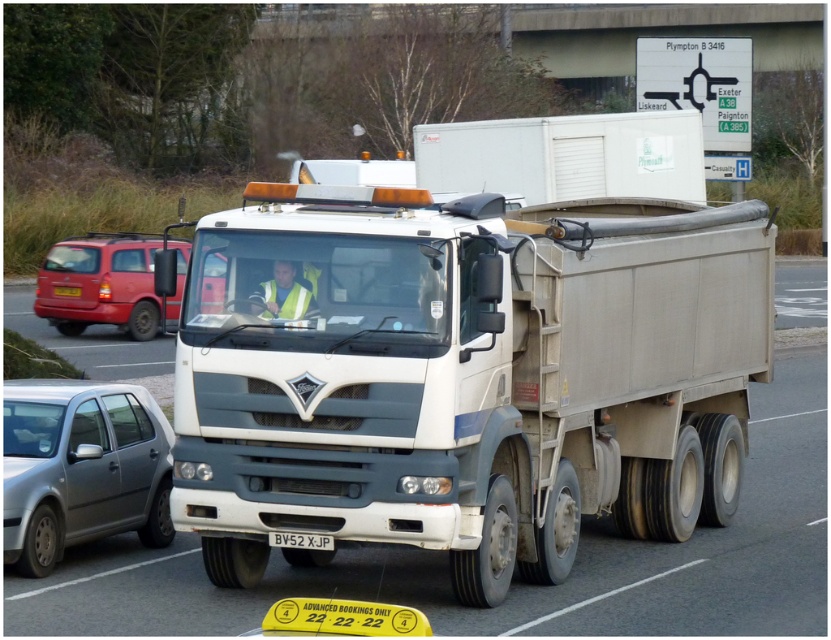
You are a delivery driver who needs to check the license plate of the white matte trailer truck at center. Can you see the white plastic license plate at center from your current position inside the cab?

The white matte trailer truck at center is positioned over the white plastic license plate at center, so the license plate is likely blocked from view from inside the cab.

You are a traffic officer observing a road scene. You notice a matte red van at left and a white plastic license plate at center. Which object is wider in the image?

The matte red van at left is wider than the white plastic license plate at center according to the description.

You are a safety inspector checking the distance between the white matte trailer truck at center and the black plastic license plate at center. According to regulations, the minimum safe distance between these two should be 15 meters. Is the current distance compliant with the regulations?

The distance between the white matte trailer truck at center and the black plastic license plate at center is 17.26 meters, which exceeds the minimum required 15 meters. Therefore, the current distance is compliant with the regulations.